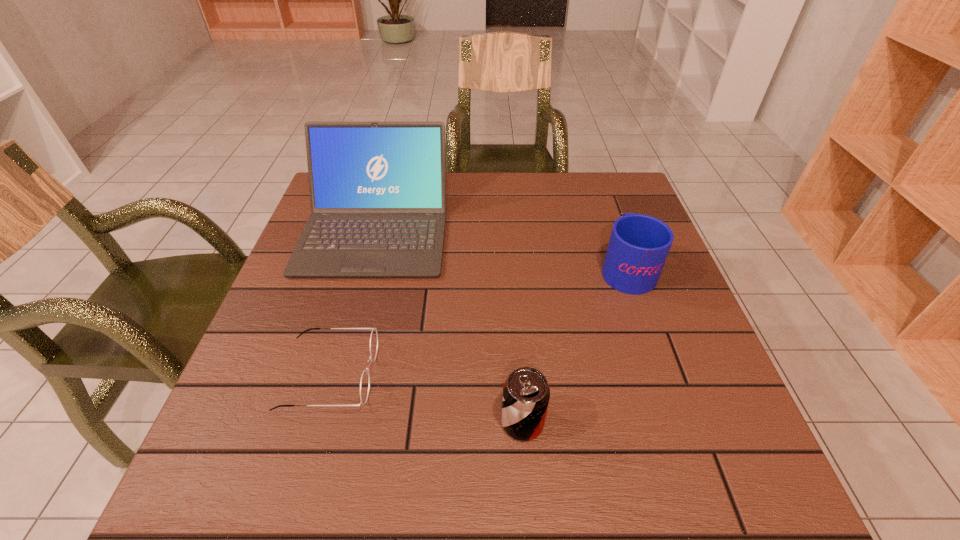
I want to click on object positioned at the far edge, so click(378, 189).

This screenshot has width=960, height=540. Find the location of `laptop computer present at the left edge`. laptop computer present at the left edge is located at coordinates (378, 189).

Identify the location of spectacles located in the left edge section of the desktop. The image size is (960, 540). (365, 378).

At what (x,y) coordinates should I click in order to perform the action: click on object at the right edge. Please return your answer as a coordinate pair (x, y). Image resolution: width=960 pixels, height=540 pixels. Looking at the image, I should click on (639, 244).

In order to click on object that is at the far left corner in this screenshot , I will do `click(378, 189)`.

In order to click on vacant space at the far edge in this screenshot , I will do `click(475, 187)`.

In order to click on free space at the near edge in this screenshot , I will do `click(465, 455)`.

The width and height of the screenshot is (960, 540). I want to click on vacant space at the left edge, so click(x=315, y=306).

The image size is (960, 540). Find the location of `free location at the right edge of the desktop`. free location at the right edge of the desktop is located at coordinates (709, 402).

Locate an element on the screen. The width and height of the screenshot is (960, 540). vacant space at the near left corner of the desktop is located at coordinates (277, 458).